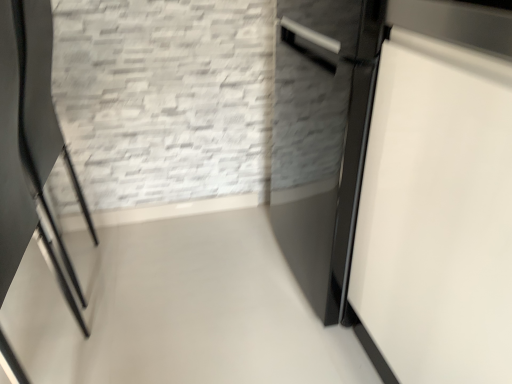
Question: Relative to white glossy door at right, is black glossy chair at left in front or behind?

Choices:
 (A) behind
 (B) front

Answer: (A)

Question: Is black glossy chair at left spatially inside white glossy door at right, or outside of it?

Choices:
 (A) inside
 (B) outside

Answer: (B)

Question: Visually, is black glossy chair at left positioned to the left or to the right of white glossy door at right?

Choices:
 (A) left
 (B) right

Answer: (A)

Question: Looking at their shapes, would you say white glossy door at right is wider or thinner than black glossy chair at left?

Choices:
 (A) thin
 (B) wide

Answer: (B)

Question: Is point (x=489, y=317) closer or farther from the camera than point (x=65, y=258)?

Choices:
 (A) farther
 (B) closer

Answer: (B)

Question: In terms of height, does white glossy door at right look taller or shorter compared to black glossy chair at left?

Choices:
 (A) short
 (B) tall

Answer: (B)

Question: In the image, is white glossy door at right positioned in front of or behind black glossy chair at left?

Choices:
 (A) front
 (B) behind

Answer: (A)